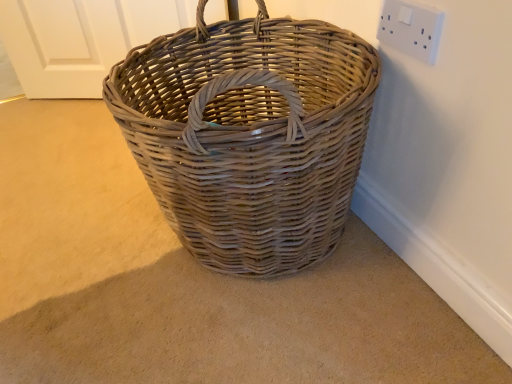
Question: Is white plastic socket at upper right bigger or smaller than natural wicker picnic basket at center?

Choices:
 (A) small
 (B) big

Answer: (A)

Question: Is white plastic socket at upper right wider or thinner than natural wicker picnic basket at center?

Choices:
 (A) thin
 (B) wide

Answer: (A)

Question: Which is correct: white plastic socket at upper right is inside natural wicker picnic basket at center, or outside of it?

Choices:
 (A) outside
 (B) inside

Answer: (A)

Question: From their relative heights in the image, would you say natural wicker picnic basket at center is taller or shorter than white plastic socket at upper right?

Choices:
 (A) tall
 (B) short

Answer: (A)

Question: From a real-world perspective, relative to white plastic socket at upper right, is natural wicker picnic basket at center vertically above or below?

Choices:
 (A) below
 (B) above

Answer: (A)

Question: Considering their positions, is natural wicker picnic basket at center located in front of or behind white plastic socket at upper right?

Choices:
 (A) front
 (B) behind

Answer: (A)

Question: Based on their sizes in the image, would you say natural wicker picnic basket at center is bigger or smaller than white plastic socket at upper right?

Choices:
 (A) big
 (B) small

Answer: (A)